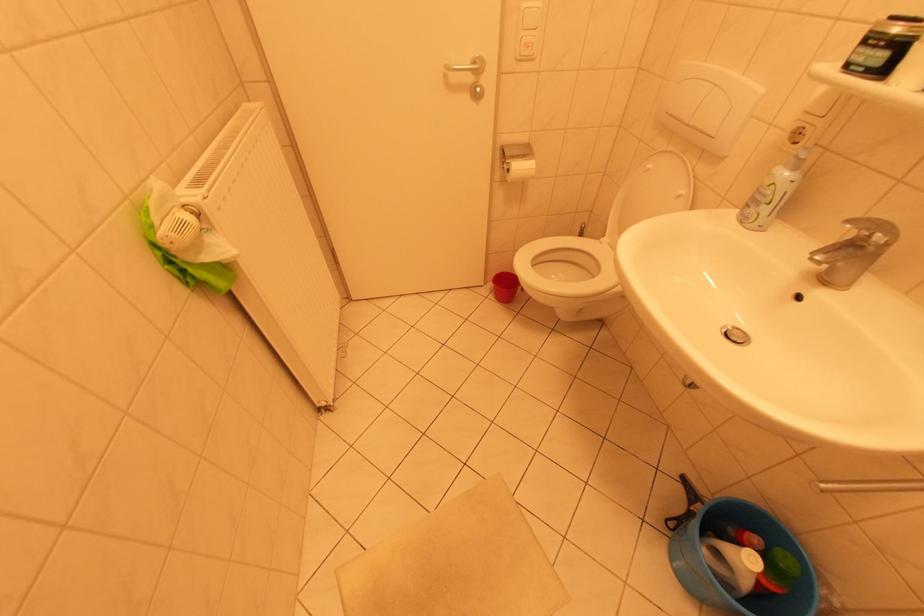
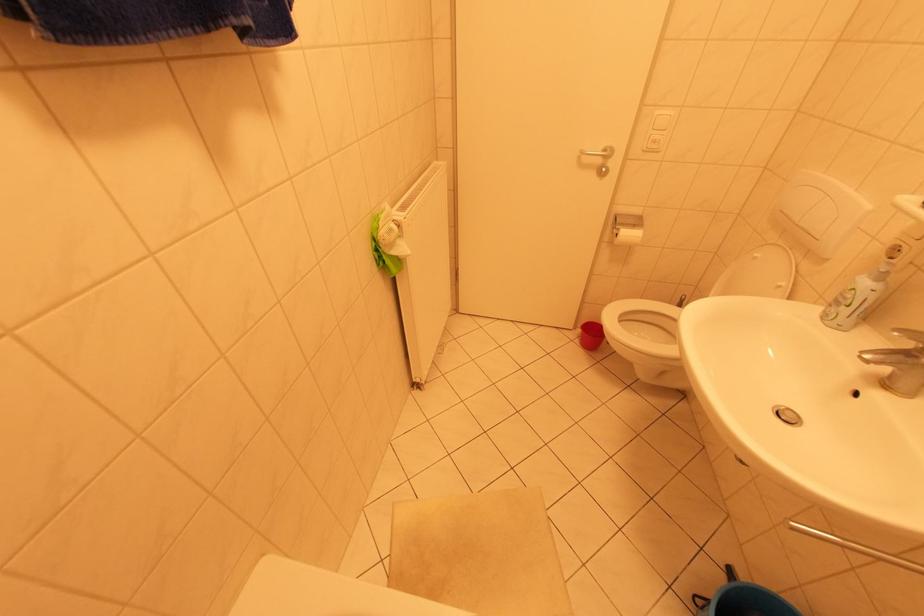
Question: The camera is either moving clockwise (left) or counter-clockwise (right) around the object. The first image is from the beginning of the video and the second image is from the end. Is the camera moving left or right when shooting the video?

Choices:
 (A) Left
 (B) Right

Answer: (B)